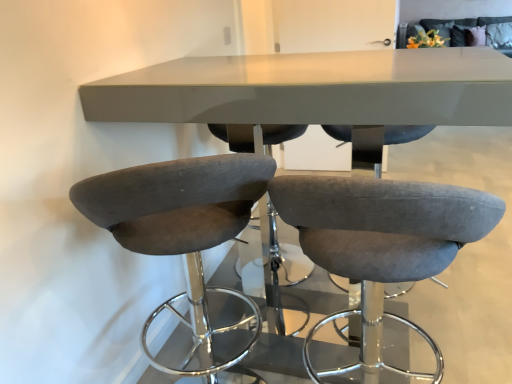
Question: Is the depth of suede-like gray bar stool at left, which appears as the first chair when viewed from the left, less than that of suede gray bar stool at center, the 1th chair viewed from the right?

Choices:
 (A) yes
 (B) no

Answer: (B)

Question: From a real-world perspective, is suede-like gray bar stool at left, which appears as the first chair when viewed from the left, physically below suede gray bar stool at center, the 1th chair viewed from the right?

Choices:
 (A) no
 (B) yes

Answer: (A)

Question: Does suede-like gray bar stool at left, which is the second chair from right to left, have a larger size compared to suede gray bar stool at center, the 2th chair from the left?

Choices:
 (A) no
 (B) yes

Answer: (B)

Question: Can you confirm if suede-like gray bar stool at left, which is the second chair from right to left, is smaller than suede gray bar stool at center, the 2th chair from the left?

Choices:
 (A) yes
 (B) no

Answer: (B)

Question: Is suede-like gray bar stool at left, which is the second chair from right to left, positioned behind suede gray bar stool at center, the 1th chair viewed from the right?

Choices:
 (A) no
 (B) yes

Answer: (B)

Question: Is suede-like gray bar stool at left, which is the second chair from right to left, thinner than suede gray bar stool at center, the 1th chair viewed from the right?

Choices:
 (A) yes
 (B) no

Answer: (B)

Question: Would you say suede-like gray bar stool at left, which appears as the first chair when viewed from the left, contains matte gray table at center?

Choices:
 (A) no
 (B) yes

Answer: (A)

Question: Can you confirm if suede-like gray bar stool at left, which is the second chair from right to left, is shorter than matte gray table at center?

Choices:
 (A) yes
 (B) no

Answer: (A)

Question: Is the depth of suede-like gray bar stool at left, which appears as the first chair when viewed from the left, less than that of matte gray table at center?

Choices:
 (A) yes
 (B) no

Answer: (A)

Question: Is suede-like gray bar stool at left, which appears as the first chair when viewed from the left, not close to matte gray table at center?

Choices:
 (A) no
 (B) yes

Answer: (A)

Question: Is suede-like gray bar stool at left, which appears as the first chair when viewed from the left, aimed at matte gray table at center?

Choices:
 (A) no
 (B) yes

Answer: (B)

Question: From the image's perspective, is suede-like gray bar stool at left, which appears as the first chair when viewed from the left, below matte gray table at center?

Choices:
 (A) no
 (B) yes

Answer: (B)

Question: From the image's perspective, is matte gray table at center located above suede-like gray bar stool at left, which is the second chair from right to left?

Choices:
 (A) no
 (B) yes

Answer: (B)